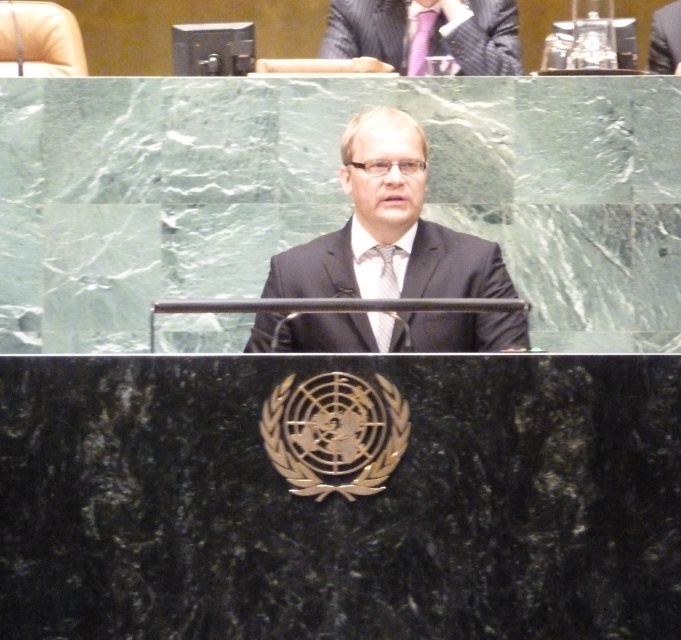
Is matte black suit at upper center below matte silver tie at center?

No.

Does point (417, 36) lie in front of point (394, 246)?

No, (417, 36) is further to viewer.

The height and width of the screenshot is (640, 681). What are the coordinates of `matte black suit at upper center` in the screenshot? It's located at (426, 33).

Does black suit at center appear on the right side of matte silver tie at center?

Indeed, black suit at center is positioned on the right side of matte silver tie at center.

Is point (475, 236) farther from viewer compared to point (360, 262)?

Yes, it is.

What do you see at coordinates (387, 228) in the screenshot?
I see `black suit at center` at bounding box center [387, 228].

Locate an element on the screen. This screenshot has height=640, width=681. black suit at center is located at coordinates (387, 228).

Which is above, matte silver tie at center or purple satin tie at upper center?

purple satin tie at upper center is higher up.

Between matte silver tie at center and purple satin tie at upper center, which one has less height?

matte silver tie at center

In the scene shown: Who is more forward, (368,253) or (417,29)?

Point (368,253) is more forward.

At what (x,y) coordinates should I click in order to perform the action: click on matte silver tie at center. Please return your answer as a coordinate pair (x, y). This screenshot has height=640, width=681. Looking at the image, I should click on (383, 268).